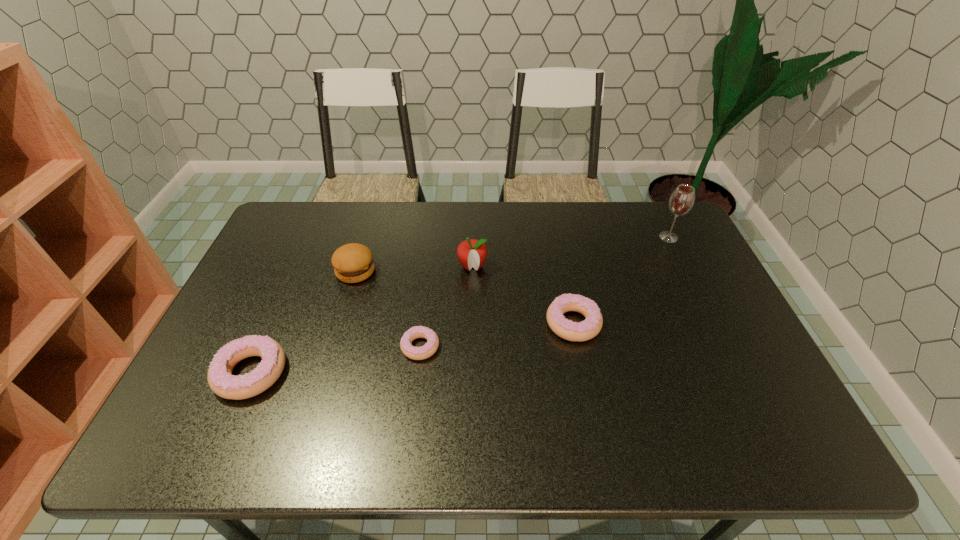
Given the evenly spaced doughnuts in the image, where should an extra doughnut be added on the right to preserve the spacing? Please point to a vacant space. Please provide its 2D coordinates. Your answer should be formatted as a tuple, i.e. [(x, y)], where the tuple contains the x and y coordinates of a point satisfying the conditions above.

[(712, 302)]